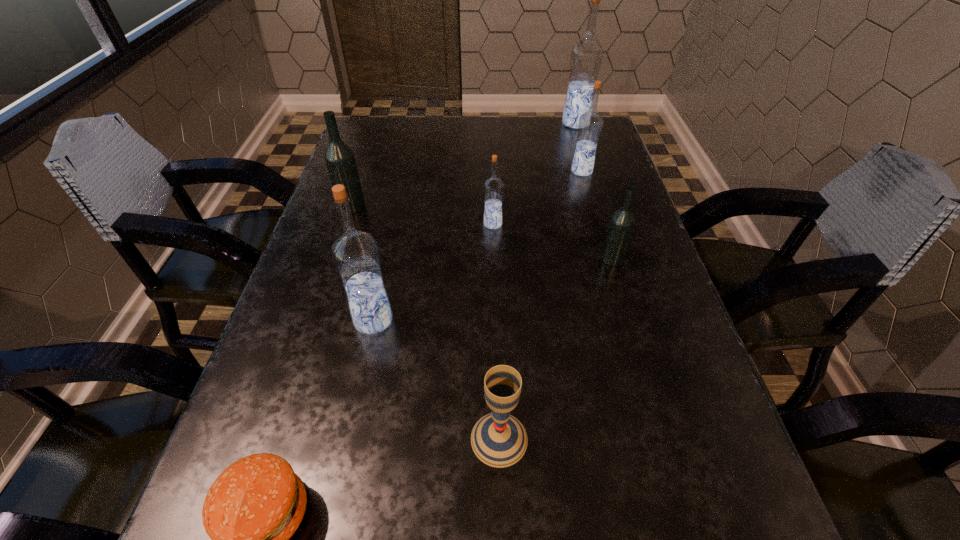
Find the location of a particular element. the tallest object is located at coordinates (586, 56).

At what (x,y) coordinates should I click in order to perform the action: click on the tallest vodka. Please return your answer as a coordinate pair (x, y). This screenshot has width=960, height=540. Looking at the image, I should click on (586, 56).

You are a GUI agent. You are given a task and a screenshot of the screen. Output one action in this format:
    pyautogui.click(x=<x>, y=<y>)
    Task: Click on the third nearest object
    The width and height of the screenshot is (960, 540).
    Given the screenshot: What is the action you would take?
    pyautogui.click(x=355, y=254)

Where is `the seventh shortest object`? The image size is (960, 540). the seventh shortest object is located at coordinates (355, 254).

Identify the location of the seventh nearest object. The image size is (960, 540). (590, 123).

Where is `the fifth nearest vodka`? The image size is (960, 540). the fifth nearest vodka is located at coordinates (590, 123).

Find the location of a particular element. the fourth nearest vodka is located at coordinates (340, 160).

Find the location of a particular element. The width and height of the screenshot is (960, 540). the sixth nearest object is located at coordinates (340, 160).

Where is `the fourth farthest object`? The height and width of the screenshot is (540, 960). the fourth farthest object is located at coordinates tap(493, 187).

The height and width of the screenshot is (540, 960). Find the location of `the second blue vodka from left to right`. the second blue vodka from left to right is located at coordinates (493, 187).